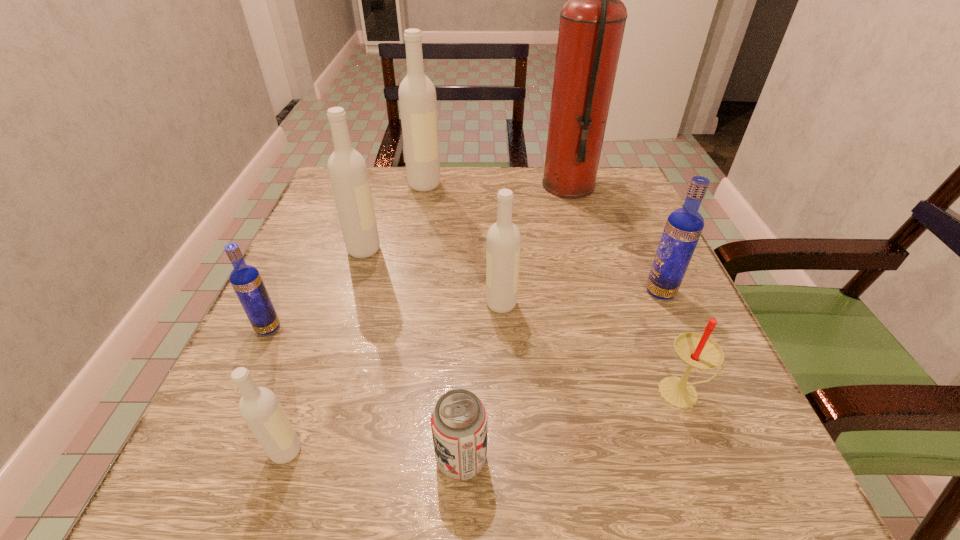
Identify the location of fire extinguisher. The image size is (960, 540). (592, 22).

At what (x,y) coordinates should I click in order to perform the action: click on the tallest object. Please return your answer as a coordinate pair (x, y). Image resolution: width=960 pixels, height=540 pixels. Looking at the image, I should click on (592, 22).

Where is `the fourth vodka from left to right`? The height and width of the screenshot is (540, 960). the fourth vodka from left to right is located at coordinates (417, 96).

Find the location of `the farthest vodka`. the farthest vodka is located at coordinates (417, 96).

At what (x,y) coordinates should I click in order to perform the action: click on the second farthest vodka. Please return your answer as a coordinate pair (x, y). Image resolution: width=960 pixels, height=540 pixels. Looking at the image, I should click on (347, 169).

At what (x,y) coordinates should I click in order to perform the action: click on the fifth shortest vodka. Please return your answer as a coordinate pair (x, y). Image resolution: width=960 pixels, height=540 pixels. Looking at the image, I should click on (347, 169).

I want to click on the bigger blue vodka, so click(684, 226).

This screenshot has height=540, width=960. I want to click on the rightmost vodka, so click(684, 226).

The width and height of the screenshot is (960, 540). In order to click on the third biggest white vodka in this screenshot , I will do `click(503, 246)`.

The width and height of the screenshot is (960, 540). In order to click on the third farthest white vodka in this screenshot , I will do `click(503, 246)`.